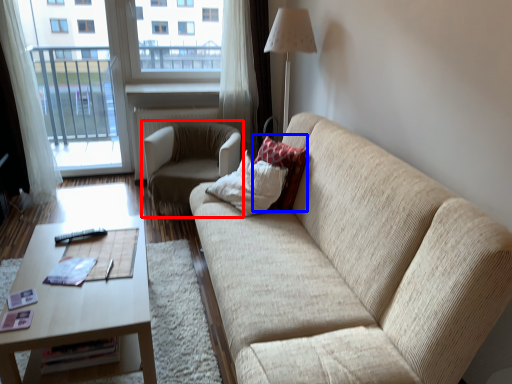
Question: Among these objects, which one is nearest to the camera, chair (highlighted by a red box) or pillow (highlighted by a blue box)?

Choices:
 (A) chair
 (B) pillow

Answer: (B)